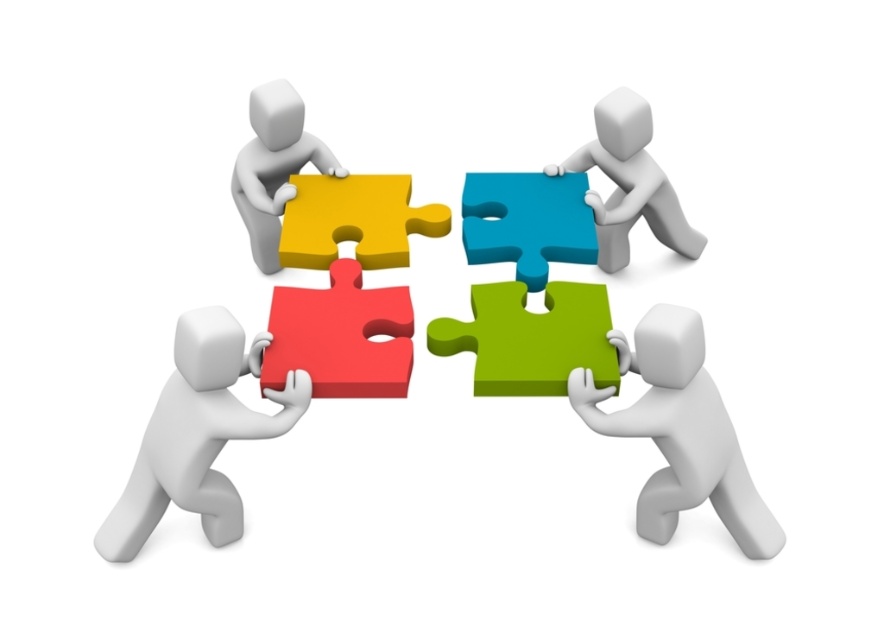
Question: Is white matte puzzle piece at upper center closer to the viewer compared to matte yellow puzzle piece at upper left?

Choices:
 (A) yes
 (B) no

Answer: (B)

Question: Which of the following is the closest to the observer?

Choices:
 (A) (646, 180)
 (B) (665, 472)
 (C) (257, 125)

Answer: (B)

Question: Based on their relative distances, which object is nearer to the matte yellow puzzle piece at upper left?

Choices:
 (A) matte white figure at lower left
 (B) green matte puzzle piece at lower right

Answer: (A)

Question: Is the position of green matte puzzle piece at lower right more distant than that of matte yellow puzzle piece at upper left?

Choices:
 (A) yes
 (B) no

Answer: (B)

Question: Does matte white figure at lower left have a smaller size compared to matte yellow puzzle piece at upper left?

Choices:
 (A) no
 (B) yes

Answer: (B)

Question: Which point is closer to the camera?

Choices:
 (A) white matte puzzle piece at upper center
 (B) matte white figure at lower left

Answer: (B)